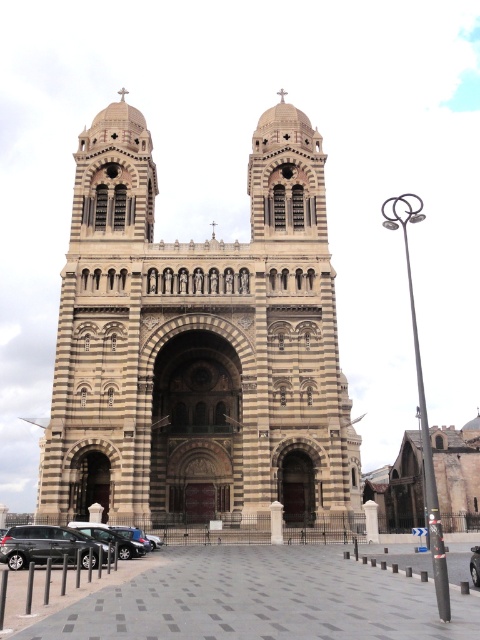
Is brown stone tower at center above metallic silver car at lower left?

Yes.

Does point (168, 376) lie behind point (1, 541)?

Yes, point (168, 376) is farther from viewer.

Where is `brown stone tower at center`? The width and height of the screenshot is (480, 640). brown stone tower at center is located at coordinates (197, 344).

Is metallic silver car at lower left to the left of shiny black sedan at lower left from the viewer's perspective?

Yes, metallic silver car at lower left is to the left of shiny black sedan at lower left.

Who is more distant from viewer, (91,544) or (152,541)?

The point (152,541) is behind.

Find the location of `metallic silver car at lower left`. metallic silver car at lower left is located at coordinates (47, 547).

Find the location of a particular element. metallic silver car at lower left is located at coordinates (47, 547).

Is metallic silver car at lower left to the left of metallic gray car at lower left from the viewer's perspective?

Indeed, metallic silver car at lower left is positioned on the left side of metallic gray car at lower left.

Is point (45, 545) positioned in front of point (101, 540)?

Yes, point (45, 545) is in front of point (101, 540).

Does point (84, 564) lie behind point (118, 540)?

No, it is in front of (118, 540).

This screenshot has height=640, width=480. Identify the location of metallic silver car at lower left. (47, 547).